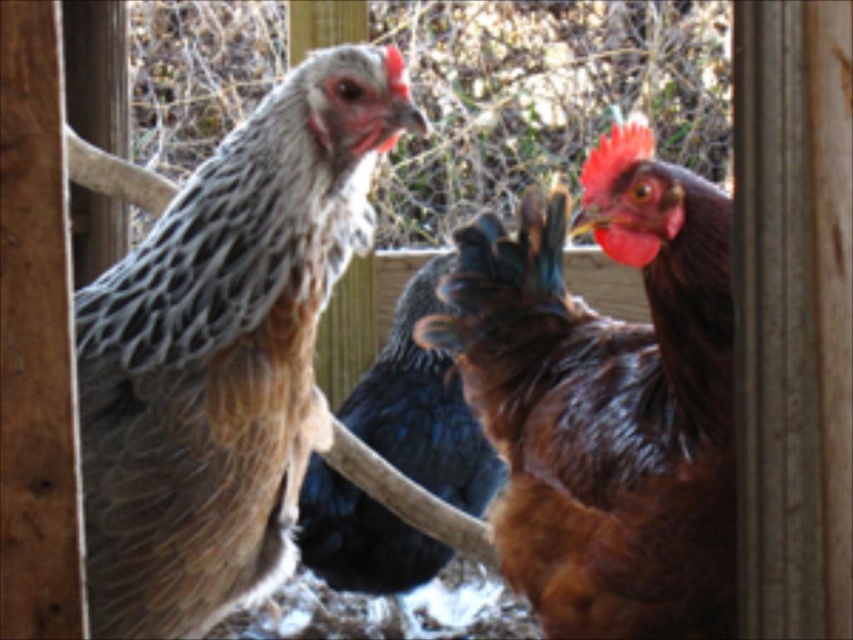
Question: Does speckled feathered chicken at left come in front of brown glossy chicken at right?

Choices:
 (A) no
 (B) yes

Answer: (B)

Question: Estimate the real-world distances between objects in this image. Which object is closer to the speckled feathered chicken at left?

Choices:
 (A) shiny black feathers at center
 (B) brown glossy chicken at right

Answer: (B)

Question: Observing the image, what is the correct spatial positioning of speckled feathered chicken at left in reference to shiny black feathers at center?

Choices:
 (A) below
 (B) above

Answer: (B)

Question: Among these objects, which one is farthest from the camera?

Choices:
 (A) brown glossy chicken at right
 (B) speckled feathered chicken at left
 (C) shiny black feathers at center

Answer: (C)

Question: Which object appears closest to the camera in this image?

Choices:
 (A) brown glossy chicken at right
 (B) shiny black feathers at center

Answer: (A)

Question: Can you confirm if speckled feathered chicken at left is positioned above brown glossy chicken at right?

Choices:
 (A) yes
 (B) no

Answer: (A)